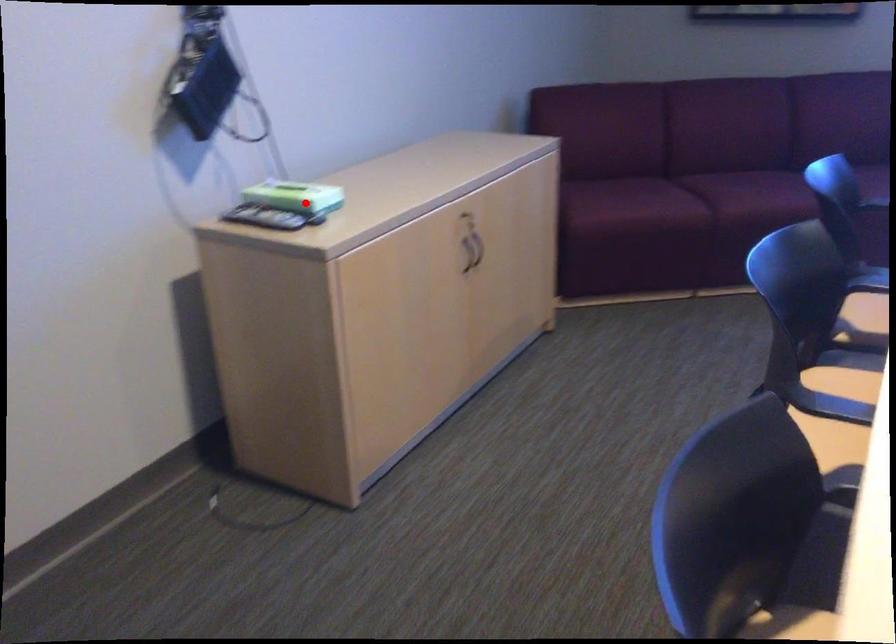
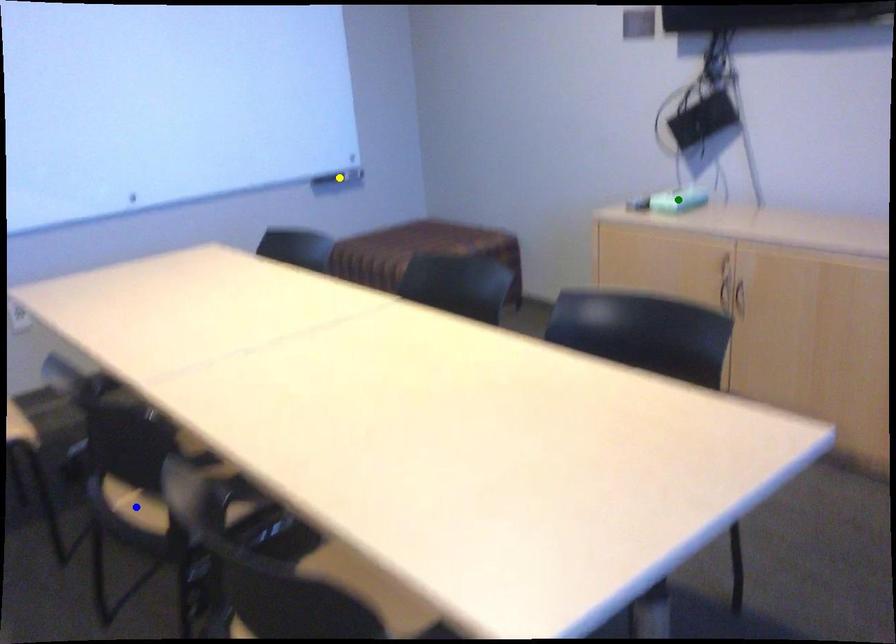
Question: I am providing you with two images of the same scene from different viewpoints. A red point is marked on the first image. You are given multiple points on the second image. Which mark in image 2 goes with the point in image 1?

Choices:
 (A) green point
 (B) yellow point
 (C) blue point

Answer: (A)